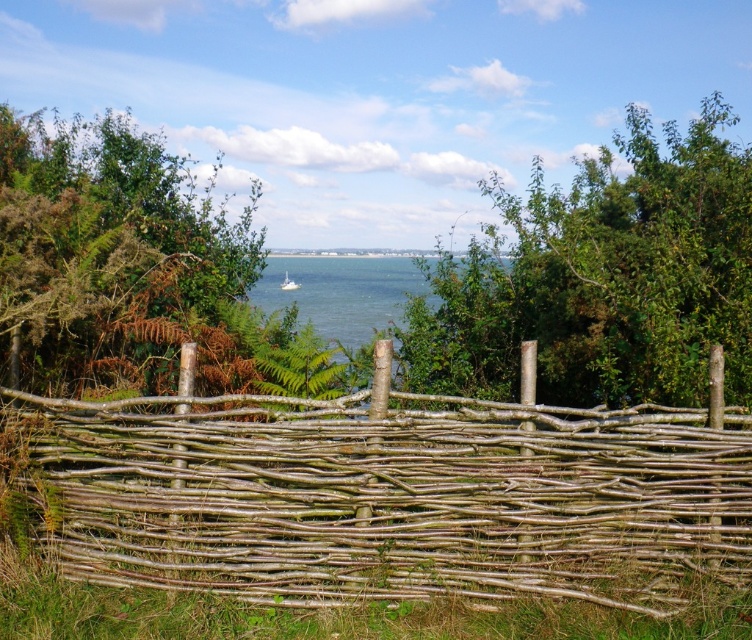
Question: Which point is farther to the camera?

Choices:
 (A) (672, 540)
 (B) (634, 342)
 (C) (279, 266)

Answer: (C)

Question: Observing the image, what is the correct spatial positioning of clear blue water at center in reference to white plastic boat at center?

Choices:
 (A) above
 (B) below

Answer: (B)

Question: Can you confirm if green leafy bush at upper left is positioned to the right of clear blue water at center?

Choices:
 (A) no
 (B) yes

Answer: (A)

Question: Can you confirm if natural wood fence at center is positioned below green leafy bush at upper left?

Choices:
 (A) yes
 (B) no

Answer: (A)

Question: Estimate the real-world distances between objects in this image. Which object is closer to the clear blue water at center?

Choices:
 (A) green leafy tree at center
 (B) white plastic boat at center
 (C) natural wood fence at center
 (D) green leafy bush at upper left

Answer: (B)

Question: Among these objects, which one is nearest to the camera?

Choices:
 (A) white plastic boat at center
 (B) green leafy bush at upper left

Answer: (B)